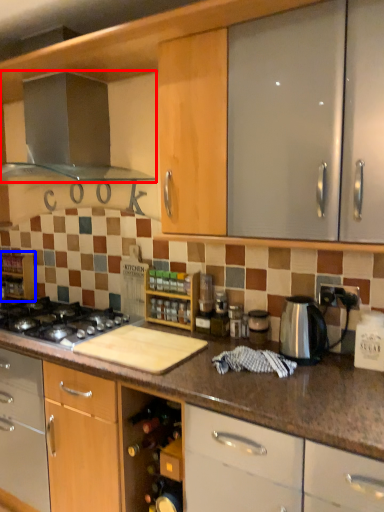
Question: Which object appears farthest to the camera in this image, kitchen appliance (highlighted by a red box) or shelf (highlighted by a blue box)?

Choices:
 (A) kitchen appliance
 (B) shelf

Answer: (B)